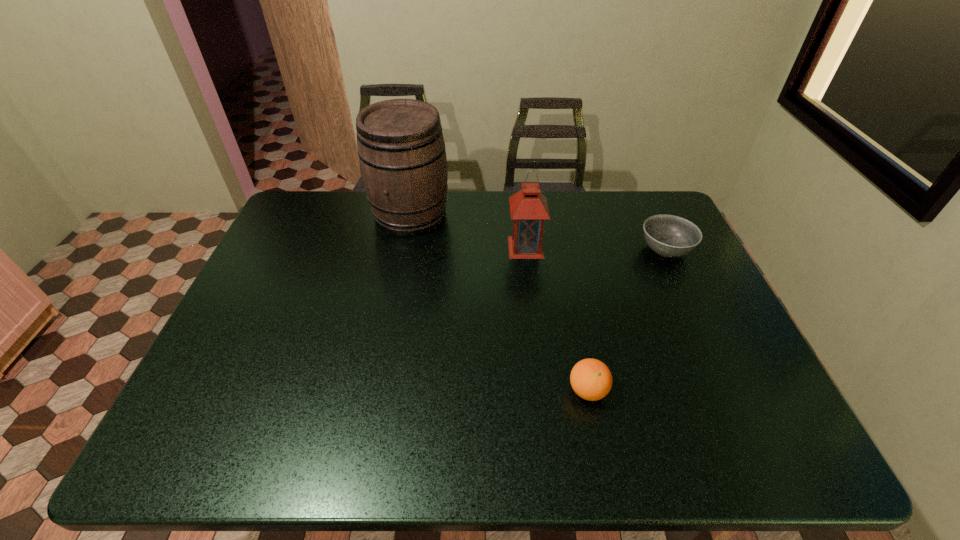
Identify which object is located as the nearest to the tallest object. Please provide its 2D coordinates. Your answer should be formatted as a tuple, i.e. [(x, y)], where the tuple contains the x and y coordinates of a point satisfying the conditions above.

[(528, 207)]